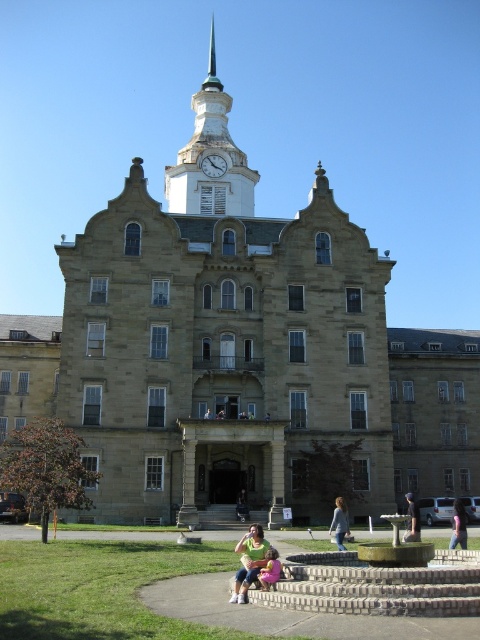
You are standing on the lawn in front of the historic building. You notice a matte green shirt at center and a white glossy clock at upper center. Which object is positioned higher up in the image?

The white glossy clock at upper center is positioned higher up in the image than the matte green shirt at center.

You are standing on the lawn in front of the historic stone building. You see the stone clock tower at center and the dark blue jeans at lower right. Which object is positioned more to the east if the building faces north?

The stone clock tower at center is to the left of dark blue jeans at lower right. Since the building faces north, the left side would correspond to the east direction. Therefore, the stone clock tower at center is positioned more to the east.